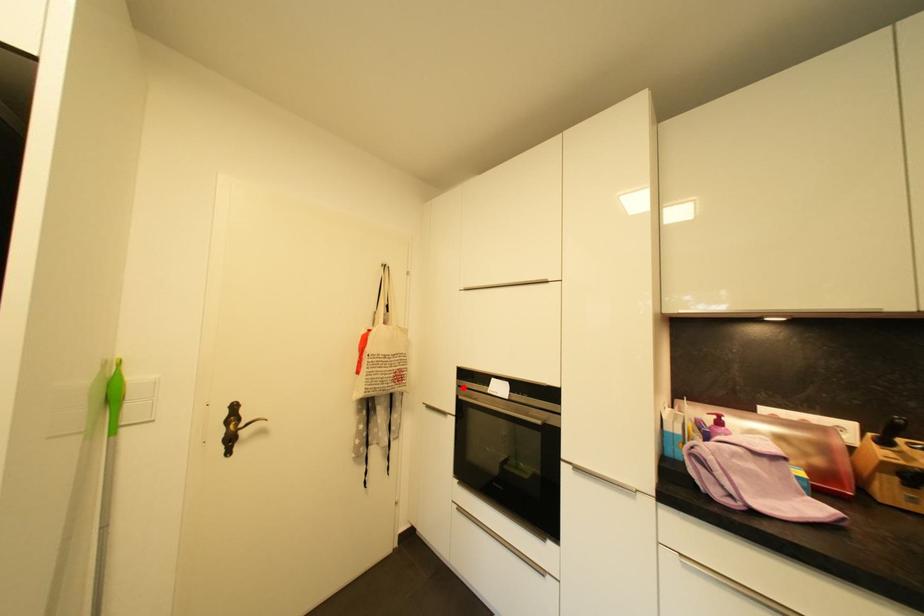
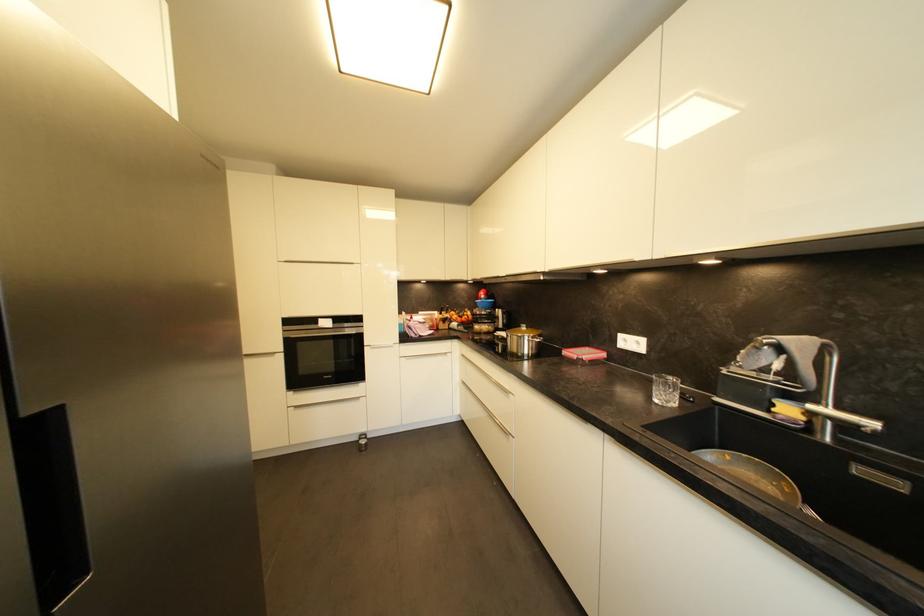
Find the pixel in the second image that matches the highlighted location in the first image.

(289, 333)